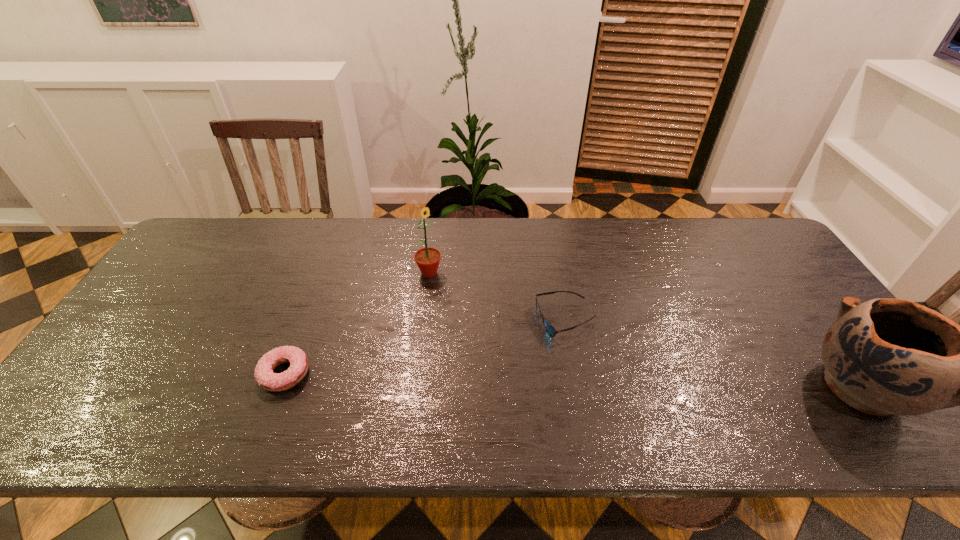
You are a GUI agent. You are given a task and a screenshot of the screen. Output one action in this format:
    pyautogui.click(x=<x>, y=<y>)
    Task: Click on the free region that satisfies the following two spatial constraints: 1. on the front side of the rightmost object; 2. on the left side of the second farthest object
    This screenshot has height=540, width=960.
    Given the screenshot: What is the action you would take?
    pyautogui.click(x=578, y=386)

This screenshot has width=960, height=540. I want to click on vacant area in the image that satisfies the following two spatial constraints: 1. on the front side of the pottery; 2. on the right side of the farthest object, so click(415, 386).